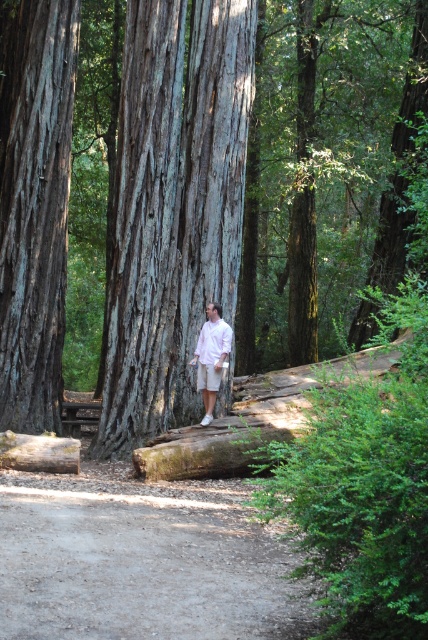
Question: Is smooth gray bark at center to the left of white matte shirt at center from the viewer's perspective?

Choices:
 (A) no
 (B) yes

Answer: (A)

Question: Among these objects, which one is farthest from the camera?

Choices:
 (A) white matte shirt at center
 (B) dirt path at lower center

Answer: (A)

Question: Which object is positioned farthest from the smooth brown tree trunk at left?

Choices:
 (A) white matte shirt at center
 (B) gray textured tree trunk at center

Answer: (A)

Question: Which object is the farthest from the smooth gray bark at center?

Choices:
 (A) gray textured tree trunk at center
 (B) white matte shirt at center
 (C) dirt path at lower center

Answer: (C)

Question: Does gray textured tree trunk at center lie behind smooth brown tree trunk at left?

Choices:
 (A) no
 (B) yes

Answer: (A)

Question: From the image, what is the correct spatial relationship of smooth gray bark at center in relation to white matte shirt at center?

Choices:
 (A) left
 (B) right

Answer: (B)